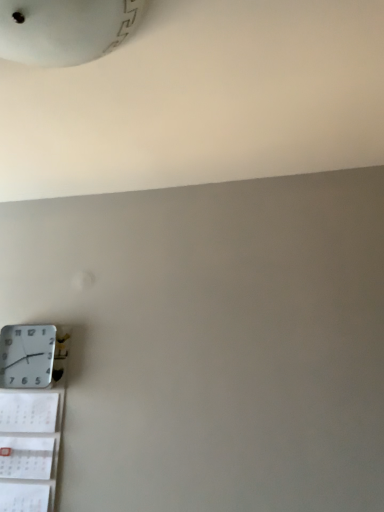
Describe the element at coordinates (31, 437) in the screenshot. The width and height of the screenshot is (384, 512). I see `white paper calendar at lower left` at that location.

Where is `white paper calendar at lower left`? This screenshot has height=512, width=384. white paper calendar at lower left is located at coordinates (31, 437).

The height and width of the screenshot is (512, 384). Identify the location of white plastic wall clock at lower left. (31, 355).

What do you see at coordinates (31, 355) in the screenshot? I see `white plastic wall clock at lower left` at bounding box center [31, 355].

In order to face white plastic wall clock at lower left, should I rotate leftwards or rightwards?

Turn left by 20.484 degrees to look at white plastic wall clock at lower left.

Locate an element on the screen. Image resolution: width=384 pixels, height=512 pixels. white paper calendar at lower left is located at coordinates (31, 437).

Considering the relative positions of white plastic wall clock at lower left and white paper calendar at lower left in the image provided, is white plastic wall clock at lower left to the right of white paper calendar at lower left from the viewer's perspective?

Incorrect, white plastic wall clock at lower left is not on the right side of white paper calendar at lower left.

Which is behind, white plastic wall clock at lower left or white paper calendar at lower left?

Positioned behind is white plastic wall clock at lower left.

Which is in front, point (41, 370) or point (35, 420)?

The point (35, 420) is closer.

From the image's perspective, which one is positioned lower, white plastic wall clock at lower left or white paper calendar at lower left?

From the image's view, white paper calendar at lower left is below.

From a real-world perspective, relative to white paper calendar at lower left, is white plastic wall clock at lower left vertically above or below?

In terms of real-world spatial position, white plastic wall clock at lower left is above white paper calendar at lower left.

Does white plastic wall clock at lower left have a lesser width compared to white paper calendar at lower left?

Incorrect, the width of white plastic wall clock at lower left is not less than that of white paper calendar at lower left.

Can you confirm if white plastic wall clock at lower left is shorter than white paper calendar at lower left?

Indeed, white plastic wall clock at lower left has a lesser height compared to white paper calendar at lower left.

Is white plastic wall clock at lower left smaller than white paper calendar at lower left?

Yes.

Is white paper calendar at lower left surrounded by white plastic wall clock at lower left?

That's incorrect, white paper calendar at lower left is not inside white plastic wall clock at lower left.

Is white plastic wall clock at lower left not near white paper calendar at lower left?

That's not correct — white plastic wall clock at lower left is a little close to white paper calendar at lower left.

Is white plastic wall clock at lower left aimed at white paper calendar at lower left?

No.

You are a GUI agent. You are given a task and a screenshot of the screen. Output one action in this format:
    pyautogui.click(x=<x>, y=<y>)
    Task: Click on the wall clock lying on the left of white paper calendar at lower left
    This screenshot has width=384, height=512.
    Given the screenshot: What is the action you would take?
    pyautogui.click(x=31, y=355)

Between white paper calendar at lower left and white plastic wall clock at lower left, which one appears on the right side from the viewer's perspective?

Positioned to the right is white paper calendar at lower left.

Consider the image. Which object is further away from the camera taking this photo, white paper calendar at lower left or white plastic wall clock at lower left?

white plastic wall clock at lower left.

Which is less distant, (19, 411) or (4, 327)?

Point (19, 411) is closer to the camera than point (4, 327).

From the image's perspective, relative to white plastic wall clock at lower left, is white paper calendar at lower left above or below?

Clearly, from the image's perspective, white paper calendar at lower left is below white plastic wall clock at lower left.

From a real-world perspective, which object stands above the other?

white plastic wall clock at lower left.

Can you confirm if white paper calendar at lower left is thinner than white plastic wall clock at lower left?

Correct, the width of white paper calendar at lower left is less than that of white plastic wall clock at lower left.

Can you confirm if white paper calendar at lower left is taller than white plastic wall clock at lower left?

Correct, white paper calendar at lower left is much taller as white plastic wall clock at lower left.

Can you confirm if white paper calendar at lower left is smaller than white plastic wall clock at lower left?

Incorrect, white paper calendar at lower left is not smaller in size than white plastic wall clock at lower left.

Is white paper calendar at lower left not within white plastic wall clock at lower left?

white paper calendar at lower left is positioned outside white plastic wall clock at lower left.

Are white paper calendar at lower left and white plastic wall clock at lower left far apart?

white paper calendar at lower left is actually quite close to white plastic wall clock at lower left.

Is white paper calendar at lower left oriented towards white plastic wall clock at lower left?

No, white paper calendar at lower left does not turn towards white plastic wall clock at lower left.

Can you tell me how much white paper calendar at lower left and white plastic wall clock at lower left differ in facing direction?

0.00145 degrees separate the facing orientations of white paper calendar at lower left and white plastic wall clock at lower left.

How distant is white paper calendar at lower left from white plastic wall clock at lower left?

6.21 inches.

This screenshot has height=512, width=384. Identify the location of shelf below the white plastic wall clock at lower left (from the image's perspective). (31, 437).

You are a GUI agent. You are given a task and a screenshot of the screen. Output one action in this format:
    pyautogui.click(x=<x>, y=<y>)
    Task: Click on the wall clock above the white paper calendar at lower left (from a real-world perspective)
    Image resolution: width=384 pixels, height=512 pixels.
    Given the screenshot: What is the action you would take?
    pyautogui.click(x=31, y=355)

The height and width of the screenshot is (512, 384). I want to click on wall clock on the left of white paper calendar at lower left, so click(31, 355).